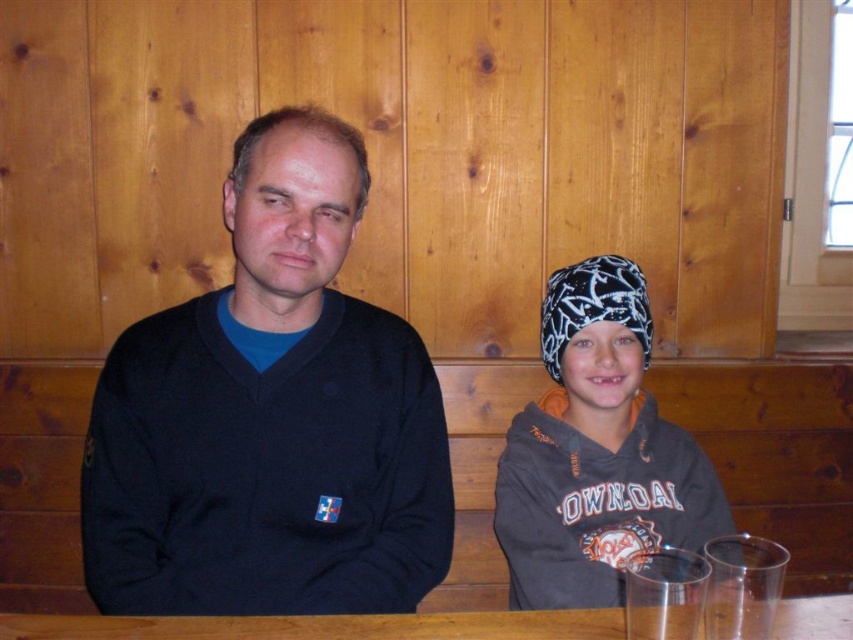
Is dark gray hoodie at center thinner than wooden table at center?

Yes.

Who is taller, dark gray hoodie at center or wooden table at center?

dark gray hoodie at center

Which is behind, point (576, 275) or point (833, 621)?

The point (576, 275) is behind.

Find the location of a particular element. dark gray hoodie at center is located at coordinates (596, 451).

Which is above, black matte sweater at center or wooden table at center?

Positioned higher is black matte sweater at center.

Consider the image. Can you confirm if black matte sweater at center is shorter than wooden table at center?

Incorrect, black matte sweater at center's height does not fall short of wooden table at center's.

Is point (288, 145) farther from camera compared to point (15, 637)?

Yes.

Identify the location of black matte sweater at center. This screenshot has width=853, height=640. (x=270, y=417).

Which is in front, point (90, 426) or point (538, 448)?

Point (90, 426) is more forward.

Does point (427, 451) come farther from viewer compared to point (589, 552)?

No.

Locate an element on the screen. Image resolution: width=853 pixels, height=640 pixels. black matte sweater at center is located at coordinates (270, 417).